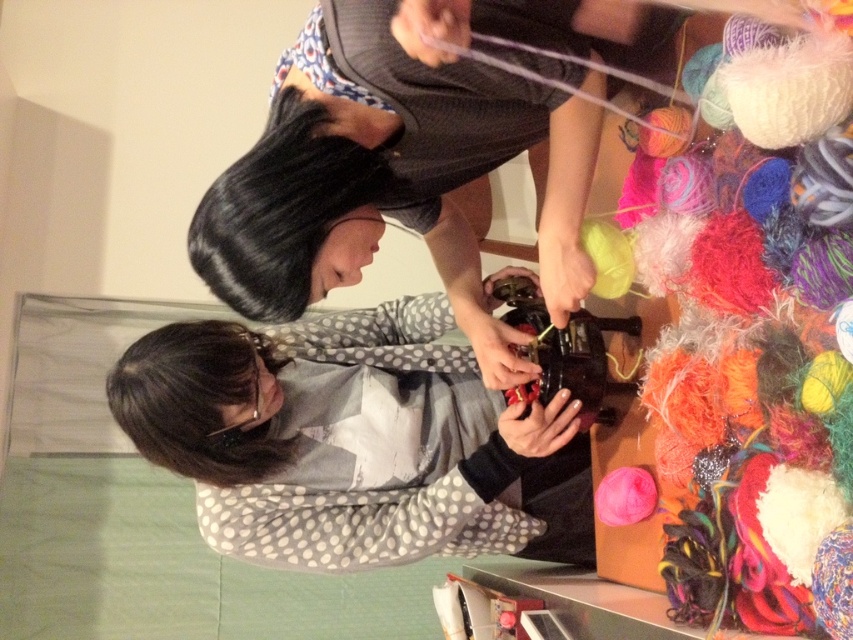
You are a fashion designer who needs to decide which item to display first in a showcase. Based on the scene, which object is taller between the polka dot fabric shirt at center and the dark brown hair at lower left?

The polka dot fabric shirt at center is much taller than the dark brown hair at lower left, so it should be displayed first.

You are a tailor measuring the distance between two points in the scene. The polka dot fabric shirt at center and the black silky hair at upper center are important for your measurement. Can you fit a 30 cm ruler between them without it overlapping either object?

The distance between the polka dot fabric shirt at center and the black silky hair at upper center is 31.74 centimeters, so yes, a 30 cm ruler can fit between them without overlapping either object since the space is slightly larger than the ruler.

You are a photographer trying to capture a closeup of the matte gray sweater at center and the dark brown hair at lower left. Which object should you focus on first to ensure both are in focus?

The matte gray sweater at center is closer to the viewer than the dark brown hair at lower left. To ensure both are in focus, you should focus on the matte gray sweater at center first since it is closer, allowing the dark brown hair at lower left to fall within the depth of field.